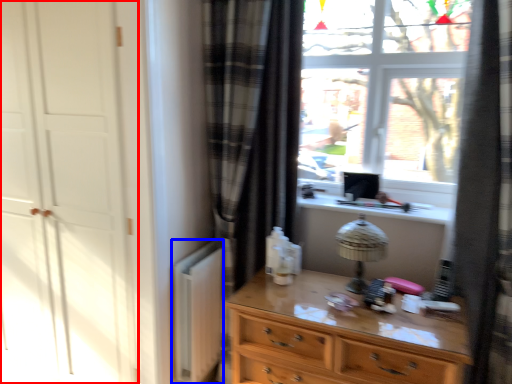
Question: Which of the following is the closest to the observer, screen door (highlighted by a red box) or radiator (highlighted by a blue box)?

Choices:
 (A) screen door
 (B) radiator

Answer: (A)